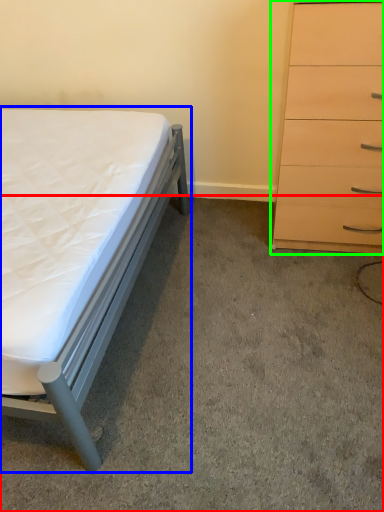
Question: Estimate the real-world distances between objects in this image. Which object is closer to concrete (highlighted by a red box), bed (highlighted by a blue box) or chest of drawers (highlighted by a green box)?

Choices:
 (A) bed
 (B) chest of drawers

Answer: (A)